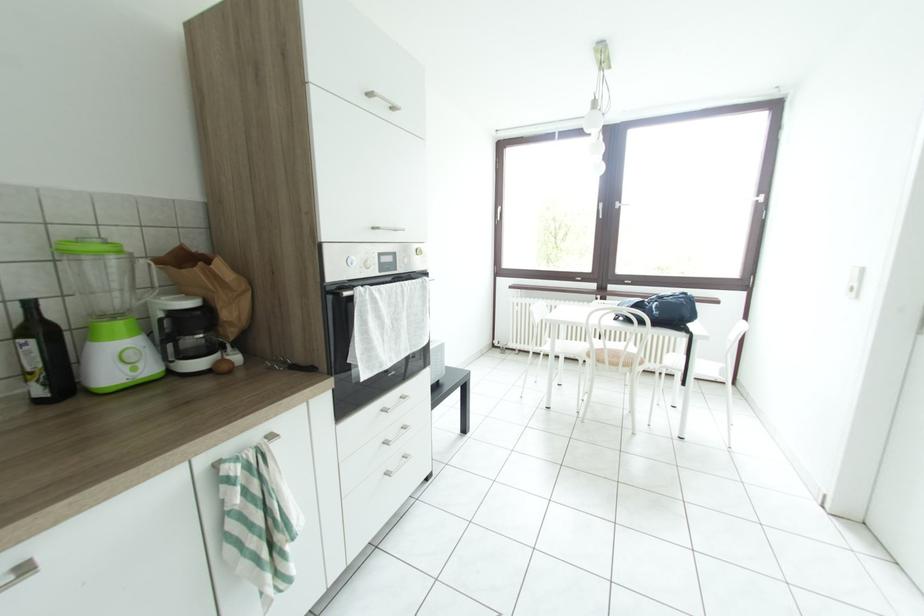
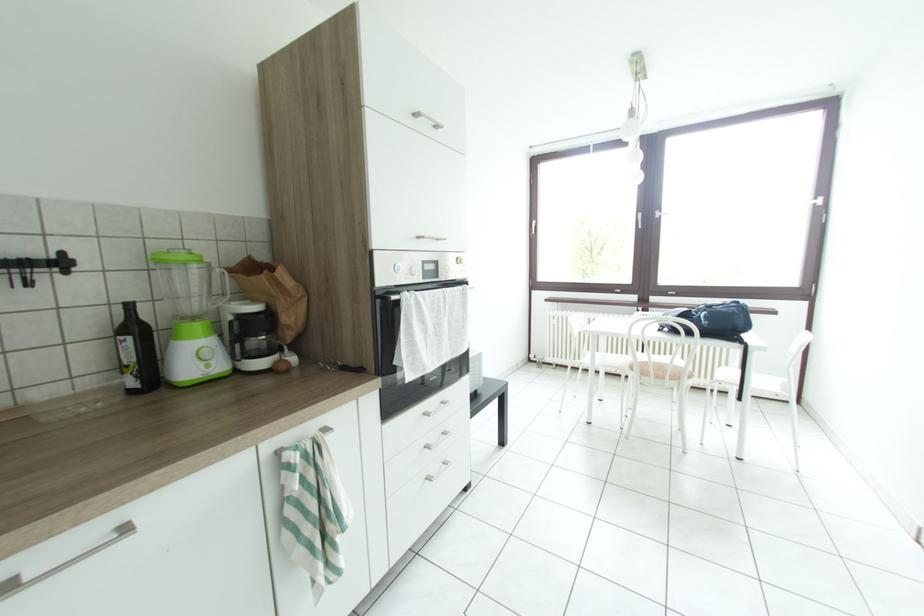
Consider the image. The images are taken continuously from a first-person perspective. In which direction are you moving?

The cameraman walked toward left, backward.